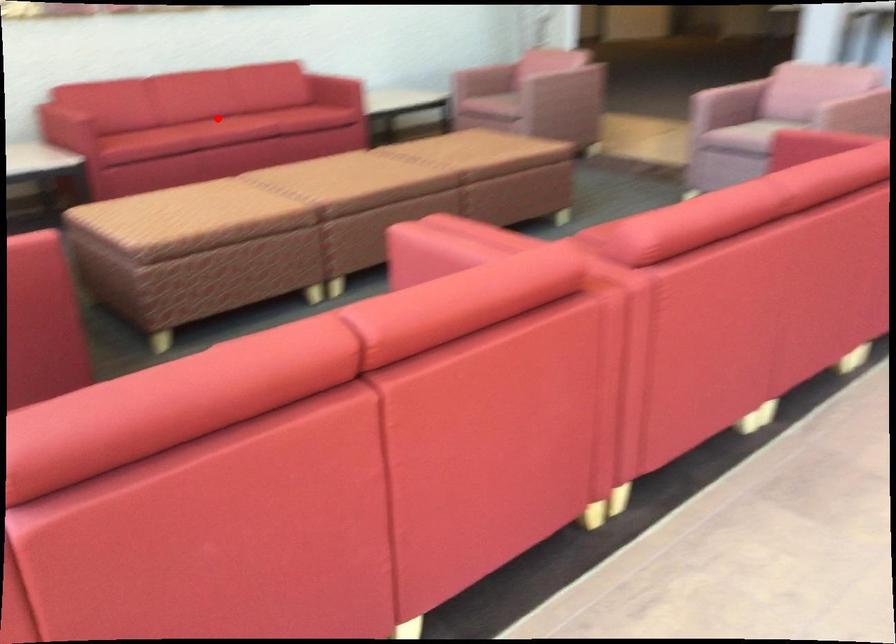
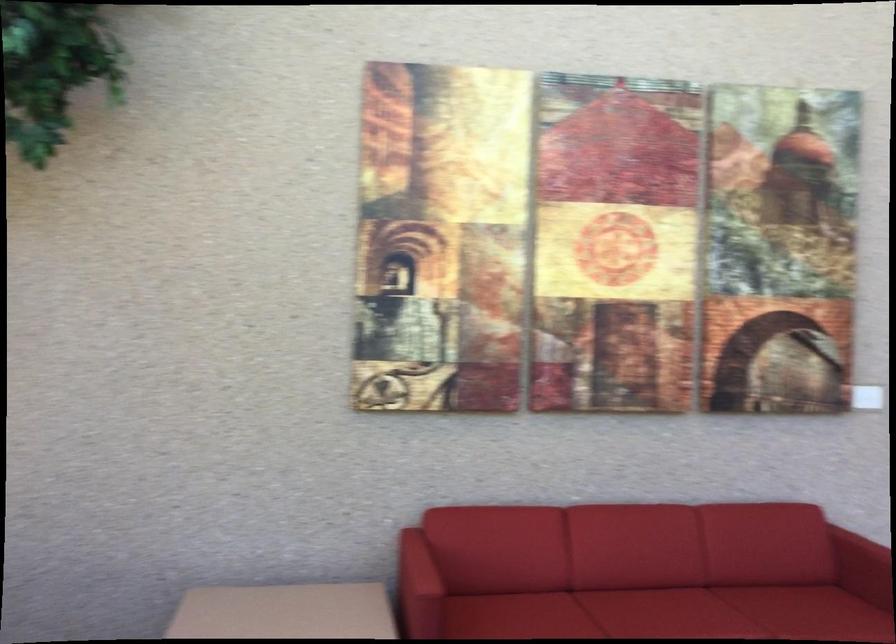
Question: A red point is marked in image1. In image2, is the corresponding 3D point closer to the camera or farther? Reply with the corresponding letter.

Choices:
 (A) The corresponding 3D point is closer.
 (B) The corresponding 3D point is farther.

Answer: (A)